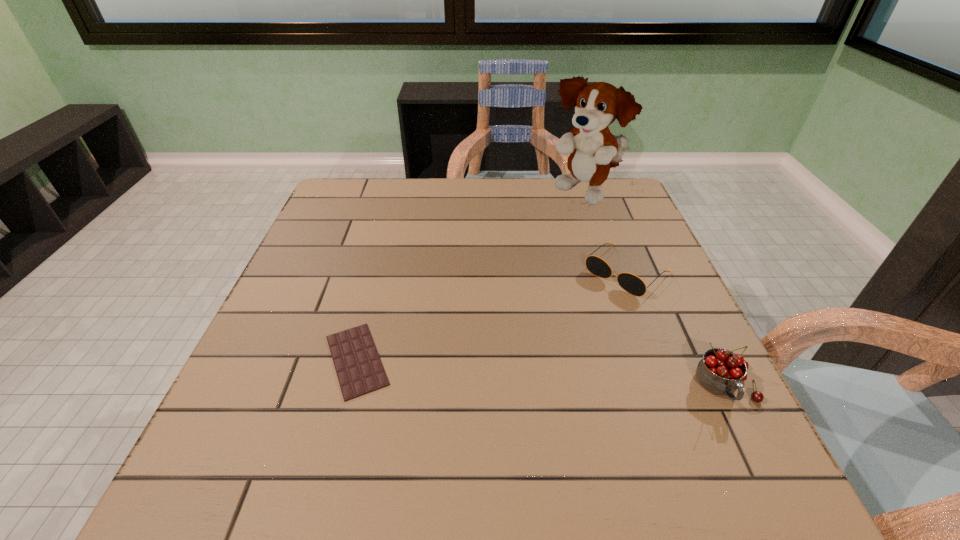
Where is `vacant area that lies between the sunglasses and the second tallest object`? vacant area that lies between the sunglasses and the second tallest object is located at coordinates (677, 329).

Identify the location of object that stands as the second closest to the pot filled with cherries. This screenshot has width=960, height=540. (598, 105).

The height and width of the screenshot is (540, 960). I want to click on object that can be found as the second closest to the leftmost object, so click(721, 372).